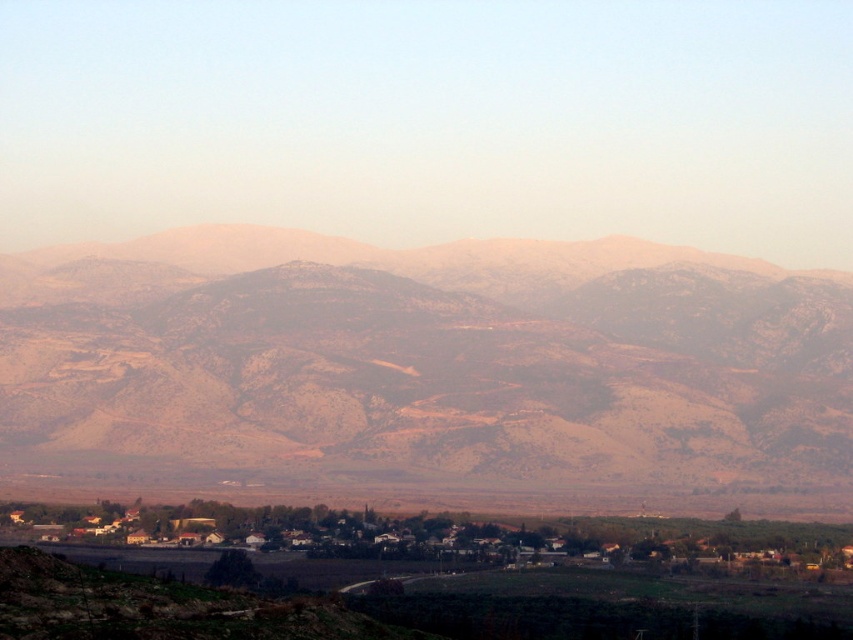
You are standing in the village and looking towards the rustic brown mountains at center. Are the brown wooden houses at center blocking your view of the mountains?

The rustic brown mountains at center are positioned over the brown wooden houses at center, so the mountains are visible above the houses and not blocked.

You are an aerial photographer planning to capture a shot of the rustic brown mountains at center and the brown wooden houses at center. Based on the scene, which object will appear smaller in the photo?

The brown wooden houses at center will appear smaller because they are positioned behind the rustic brown mountains at center, making them farther away from the camera.